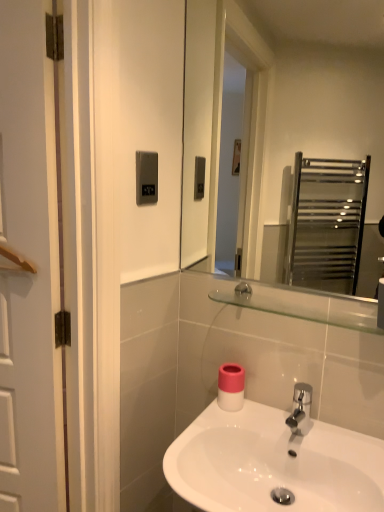
Identify the location of unoccupied area in front of pink matte toilet paper at center. (238, 422).